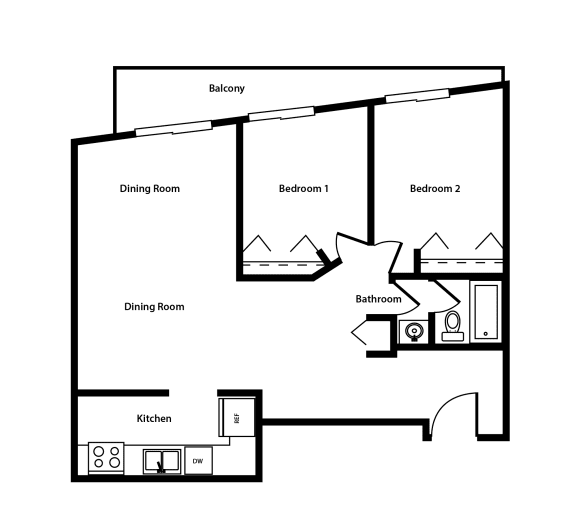
Find the location of a particular element. The width and height of the screenshot is (576, 518). stove is located at coordinates (106, 456).